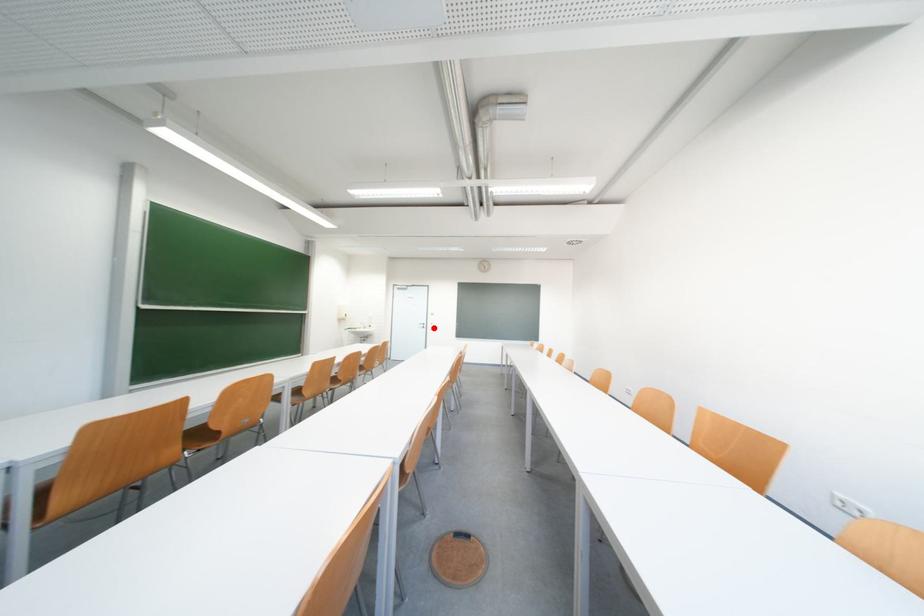
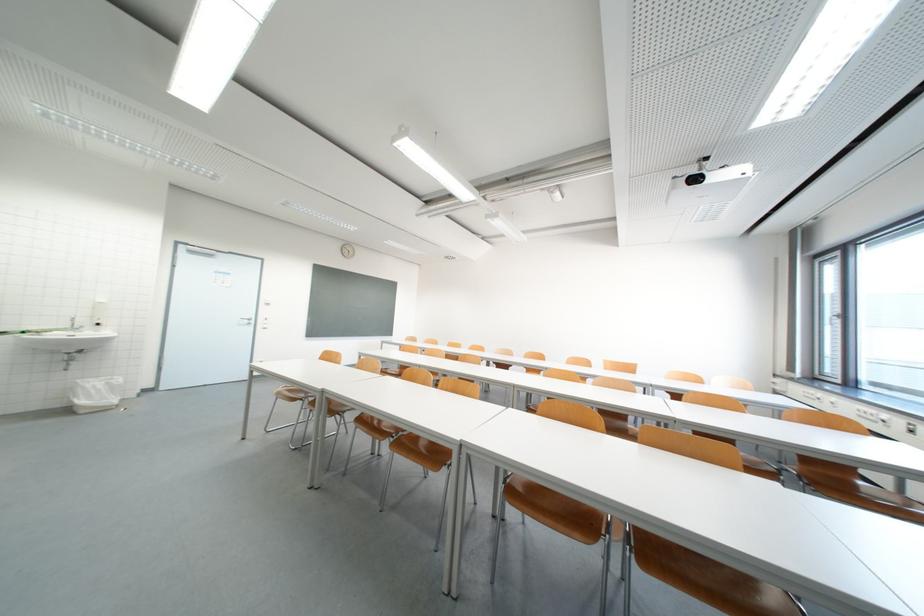
Locate, in the second image, the point that corresponds to the highlighted location in the first image.

(261, 323)